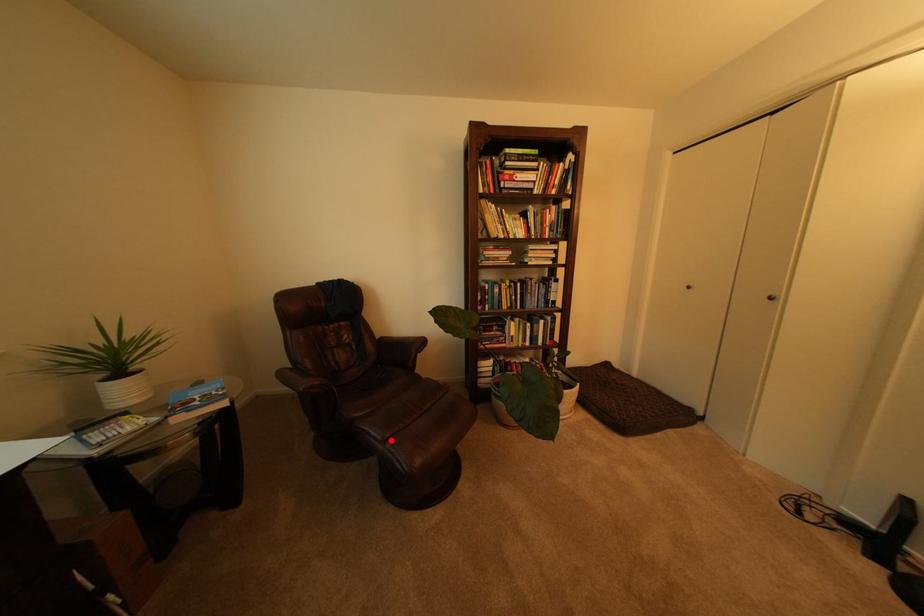
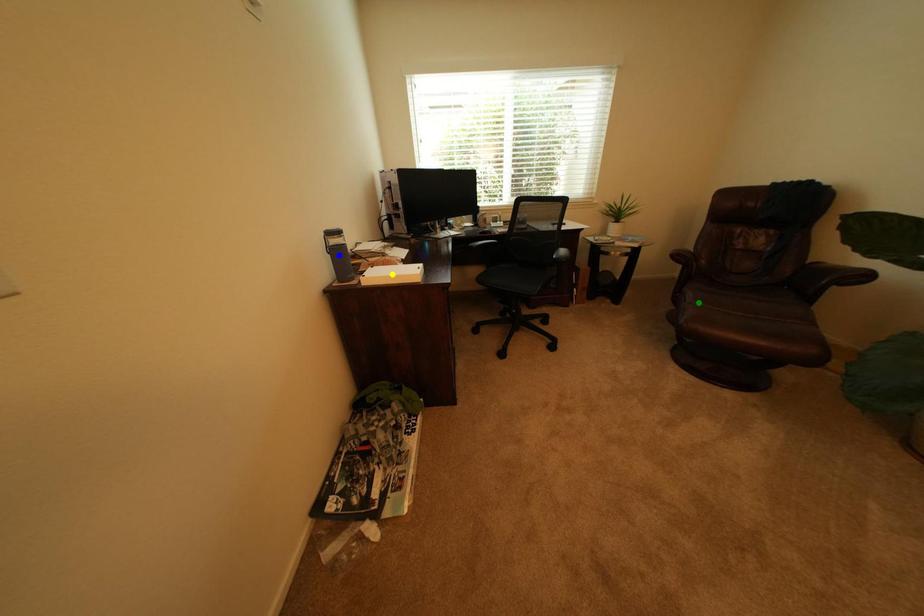
Question: I am providing you with two images of the same scene from different viewpoints. A red point is marked on the first image. You are given multiple points on the second image. Which spot in image 2 lines up with the point in image 1?

Choices:
 (A) green point
 (B) blue point
 (C) yellow point

Answer: (A)